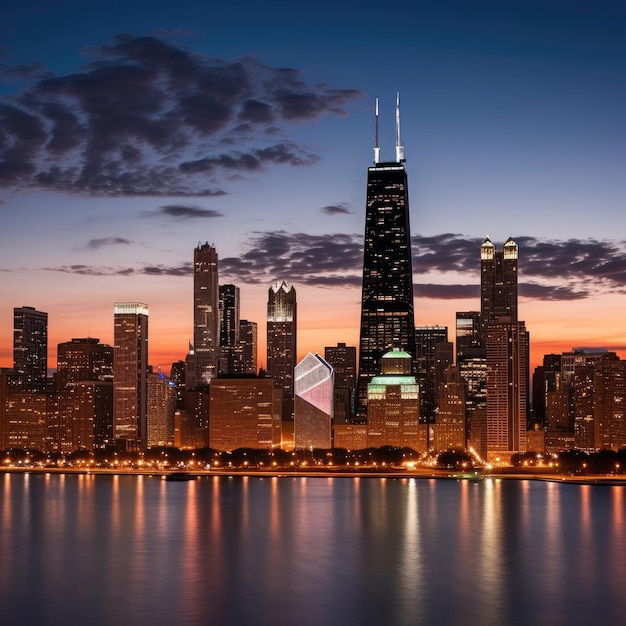
This screenshot has width=626, height=626. I want to click on lights, so click(192, 462), click(165, 464), click(141, 463), click(118, 461), click(489, 466), click(408, 464).